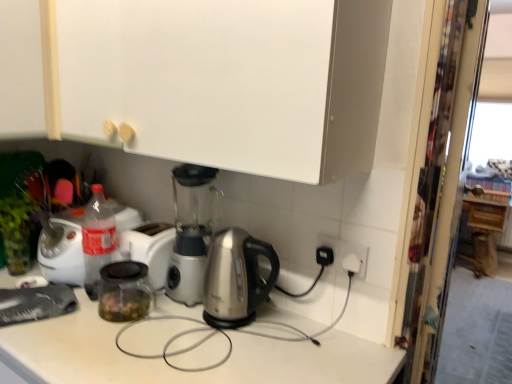
This screenshot has width=512, height=384. Describe the element at coordinates (183, 372) in the screenshot. I see `satin silver kettle at center` at that location.

Find the location of a particular element. The height and width of the screenshot is (384, 512). transparent plastic screen door at right is located at coordinates (442, 185).

Which of these two, white matte cabinet at upper center, the first cabinetry from the front, or transparent plastic screen door at right, stands shorter?

Standing shorter between the two is white matte cabinet at upper center, the first cabinetry from the front.

Do you think white matte cabinet at upper center, arranged as the third cabinetry when viewed from the back, is within transparent plastic screen door at right, or outside of it?

white matte cabinet at upper center, arranged as the third cabinetry when viewed from the back, is outside transparent plastic screen door at right.

Can you confirm if white matte cabinet at upper center, arranged as the second cabinetry when viewed from the left, is positioned to the left of transparent plastic screen door at right?

Correct, you'll find white matte cabinet at upper center, arranged as the second cabinetry when viewed from the left, to the left of transparent plastic screen door at right.

Is point (200, 133) more distant than point (467, 25)?

That is False.

From a real-world perspective, is satin silver kettle at center physically below white matte cabinet at upper left, placed as the first cabinetry when sorted from left to right?

Yes, from a real-world perspective, satin silver kettle at center is beneath white matte cabinet at upper left, placed as the first cabinetry when sorted from left to right.

Considering the relative sizes of satin silver kettle at center and white matte cabinet at upper left, placed as the first cabinetry when sorted from left to right, in the image provided, is satin silver kettle at center shorter than white matte cabinet at upper left, placed as the first cabinetry when sorted from left to right,?

Yes.

Is satin silver kettle at center facing away from white matte cabinet at upper left, the 3th cabinetry positioned from the right?

That's not correct — satin silver kettle at center is not looking away from white matte cabinet at upper left, the 3th cabinetry positioned from the right.

This screenshot has height=384, width=512. I want to click on counter top located on the right of white matte cabinet at upper left, placed as the first cabinetry when sorted from left to right, so tap(183, 372).

Between satin silver kettle at center and transparent plastic screen door at right, which one has less height?

satin silver kettle at center.

Is satin silver kettle at center positioned with its back to transparent plastic screen door at right?

That's right, satin silver kettle at center is facing away from transparent plastic screen door at right.

From the image's perspective, is satin silver kettle at center on top of transparent plastic screen door at right?

Actually, satin silver kettle at center appears below transparent plastic screen door at right in the image.

You are a GUI agent. You are given a task and a screenshot of the screen. Output one action in this format:
    pyautogui.click(x=<x>, y=<y>)
    Task: Click on the screen door behind the satin silver kettle at center
    
    Given the screenshot: What is the action you would take?
    pyautogui.click(x=442, y=185)

Is the depth of white matte cabinet at upper left, the 2th cabinetry viewed from the back, less than that of satin silver kettle at center?

No, the depth of white matte cabinet at upper left, the 2th cabinetry viewed from the back, is greater than that of satin silver kettle at center.

Based on their positions, is white matte cabinet at upper left, which is the second cabinetry in front-to-back order, located to the left or right of satin silver kettle at center?

white matte cabinet at upper left, which is the second cabinetry in front-to-back order, is to the left of satin silver kettle at center.

Between white matte cabinet at upper left, which is the second cabinetry in front-to-back order, and satin silver kettle at center, which one has larger width?

satin silver kettle at center.

Does point (9, 89) come in front of point (179, 330)?

No, it is behind (179, 330).

Looking at the image, does wooden cabinet at right, which is the 1th cabinetry from back to front, seem bigger or smaller compared to satin silver kettle at center?

In the image, wooden cabinet at right, which is the 1th cabinetry from back to front, appears to be larger than satin silver kettle at center.

Would you say wooden cabinet at right, which is the 1th cabinetry from back to front, is inside or outside satin silver kettle at center?

wooden cabinet at right, which is the 1th cabinetry from back to front, is located beyond the bounds of satin silver kettle at center.

How different are the orientations of wooden cabinet at right, the first cabinetry when ordered from right to left, and satin silver kettle at center in degrees?

The facing directions of wooden cabinet at right, the first cabinetry when ordered from right to left, and satin silver kettle at center are 1.83 degrees apart.

Can you tell me how much satin silver kettle at center and wooden cabinet at right, the third cabinetry from the left, differ in facing direction?

They differ by 1.83 degrees in their facing directions.

Is satin silver kettle at center closer to camera compared to wooden cabinet at right, arranged as the third cabinetry when viewed from the front?

Yes, satin silver kettle at center is closer to the camera.

Consider the image. Is satin silver kettle at center not close to wooden cabinet at right, which is the 1th cabinetry from back to front?

That's right, there is a large distance between satin silver kettle at center and wooden cabinet at right, which is the 1th cabinetry from back to front.

Considering the sizes of objects wooden cabinet at right, arranged as the third cabinetry when viewed from the front, and white matte cabinet at upper center, the first cabinetry from the front, in the image provided, who is smaller, wooden cabinet at right, arranged as the third cabinetry when viewed from the front, or white matte cabinet at upper center, the first cabinetry from the front,?

wooden cabinet at right, arranged as the third cabinetry when viewed from the front.

Based on the photo, is white matte cabinet at upper center, the first cabinetry from the front, inside wooden cabinet at right, which is the 1th cabinetry from back to front?

Definitely not — white matte cabinet at upper center, the first cabinetry from the front, is not inside wooden cabinet at right, which is the 1th cabinetry from back to front.

Does point (490, 262) come behind point (36, 92)?

Yes.

Is wooden cabinet at right, which is the 1th cabinetry from back to front, oriented away from white matte cabinet at upper center, the second cabinetry viewed from the right?

No, wooden cabinet at right, which is the 1th cabinetry from back to front,'s orientation is not away from white matte cabinet at upper center, the second cabinetry viewed from the right.

Locate an element on the screen. The height and width of the screenshot is (384, 512). screen door beneath the white matte cabinet at upper center, the second cabinetry viewed from the right (from a real-world perspective) is located at coordinates (442, 185).

Find the location of `cabinetry that is the 2nd one when counting backward from the satin silver kettle at center`. cabinetry that is the 2nd one when counting backward from the satin silver kettle at center is located at coordinates (29, 70).

Which object lies nearer to the anchor point white matte cabinet at upper left, which is the second cabinetry in front-to-back order, satin silver kettle at center or wooden cabinet at right, the third cabinetry from the left?

satin silver kettle at center.

From the picture: From the image, which object appears to be farther from satin silver kettle at center, transparent plastic screen door at right or wooden cabinet at right, arranged as the third cabinetry when viewed from the front?

The object further to satin silver kettle at center is wooden cabinet at right, arranged as the third cabinetry when viewed from the front.

From the image, which object appears to be nearer to white matte cabinet at upper center, the second cabinetry viewed from the right, satin silver kettle at center or transparent plastic screen door at right?

Among the two, satin silver kettle at center is located nearer to white matte cabinet at upper center, the second cabinetry viewed from the right.

From the image, which object appears to be nearer to satin silver kettle at center, wooden cabinet at right, the third cabinetry from the left, or white matte cabinet at upper left, the 2th cabinetry viewed from the back?

white matte cabinet at upper left, the 2th cabinetry viewed from the back, lies closer to satin silver kettle at center than the other object.

Estimate the real-world distances between objects in this image. Which object is further from transparent plastic screen door at right, white matte cabinet at upper center, arranged as the second cabinetry when viewed from the left, or white matte cabinet at upper left, the 2th cabinetry viewed from the back?

white matte cabinet at upper left, the 2th cabinetry viewed from the back, is further to transparent plastic screen door at right.

Considering their positions, is satin silver kettle at center positioned further to white matte cabinet at upper left, placed as the first cabinetry when sorted from left to right, than transparent plastic screen door at right?

transparent plastic screen door at right lies further to white matte cabinet at upper left, placed as the first cabinetry when sorted from left to right, than the other object.

Which object lies further to the anchor point white matte cabinet at upper left, placed as the first cabinetry when sorted from left to right, white matte cabinet at upper center, arranged as the third cabinetry when viewed from the back, or satin silver kettle at center?

The object further to white matte cabinet at upper left, placed as the first cabinetry when sorted from left to right, is satin silver kettle at center.

Which object lies nearer to the anchor point white matte cabinet at upper center, the first cabinetry from the front, white matte cabinet at upper left, the 2th cabinetry viewed from the back, or transparent plastic screen door at right?

Based on the image, white matte cabinet at upper left, the 2th cabinetry viewed from the back, appears to be nearer to white matte cabinet at upper center, the first cabinetry from the front.

Where is `counter top situated between white matte cabinet at upper center, arranged as the third cabinetry when viewed from the back, and transparent plastic screen door at right from left to right`? This screenshot has width=512, height=384. counter top situated between white matte cabinet at upper center, arranged as the third cabinetry when viewed from the back, and transparent plastic screen door at right from left to right is located at coordinates (183, 372).

The image size is (512, 384). What are the coordinates of `cabinetry between white matte cabinet at upper left, the 2th cabinetry viewed from the back, and satin silver kettle at center vertically` in the screenshot? It's located at (201, 80).

Where is `counter top between white matte cabinet at upper left, the 2th cabinetry viewed from the back, and wooden cabinet at right, the third cabinetry from the left, from left to right`? This screenshot has height=384, width=512. counter top between white matte cabinet at upper left, the 2th cabinetry viewed from the back, and wooden cabinet at right, the third cabinetry from the left, from left to right is located at coordinates (183, 372).

I want to click on screen door located between satin silver kettle at center and wooden cabinet at right, which is the 1th cabinetry from back to front, in the depth direction, so click(442, 185).